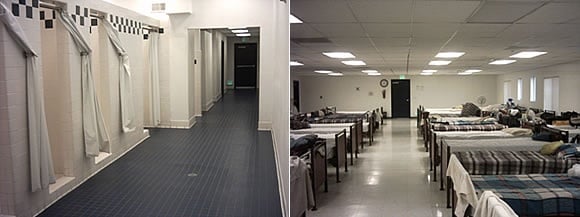
Image resolution: width=580 pixels, height=217 pixels. Identify the location of windowe. (525, 104).